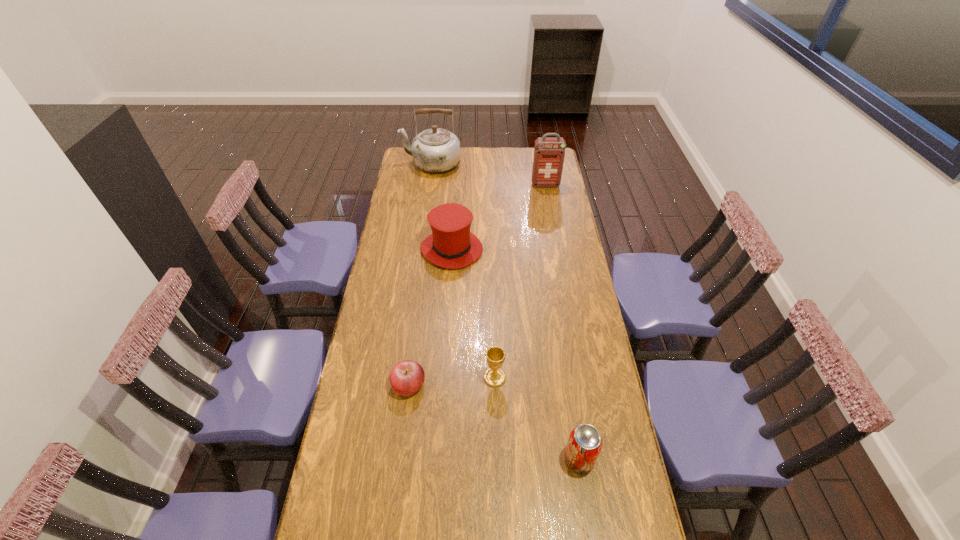
Where is `free spot located on the right of the chalice`? The image size is (960, 540). free spot located on the right of the chalice is located at coordinates (542, 377).

This screenshot has width=960, height=540. What are the coordinates of `free space located 0.210m on the right of the apple` in the screenshot? It's located at (487, 385).

You are a GUI agent. You are given a task and a screenshot of the screen. Output one action in this format:
    pyautogui.click(x=<x>, y=<y>)
    Task: Click on the object located at the far edge
    The width and height of the screenshot is (960, 540).
    Given the screenshot: What is the action you would take?
    pyautogui.click(x=436, y=150)

This screenshot has height=540, width=960. I want to click on kettle that is at the left edge, so click(436, 150).

Where is `apple positioned at the left edge`? apple positioned at the left edge is located at coordinates (407, 377).

This screenshot has height=540, width=960. What are the coordinates of `the first-aid kit positioned at the right edge` in the screenshot? It's located at (549, 153).

Image resolution: width=960 pixels, height=540 pixels. What are the coordinates of `soda can that is at the right edge` in the screenshot? It's located at (584, 445).

Where is `object that is at the far left corner`? object that is at the far left corner is located at coordinates (436, 150).

Where is `vacant area at the far edge of the desktop`? vacant area at the far edge of the desktop is located at coordinates (505, 150).

Identify the location of free space at the left edge of the desktop. This screenshot has width=960, height=540. (345, 438).